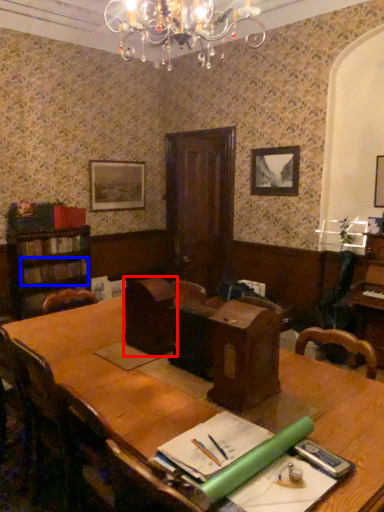
Question: Which object appears closest to the camera in this image, armchair (highlighted by a red box) or book (highlighted by a blue box)?

Choices:
 (A) armchair
 (B) book

Answer: (A)